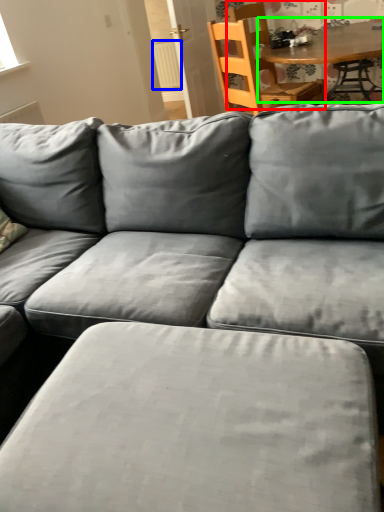
Question: Estimate the real-world distances between objects in this image. Which object is farther from chair (highlighted by a red box), radiator (highlighted by a blue box) or table (highlighted by a green box)?

Choices:
 (A) radiator
 (B) table

Answer: (A)